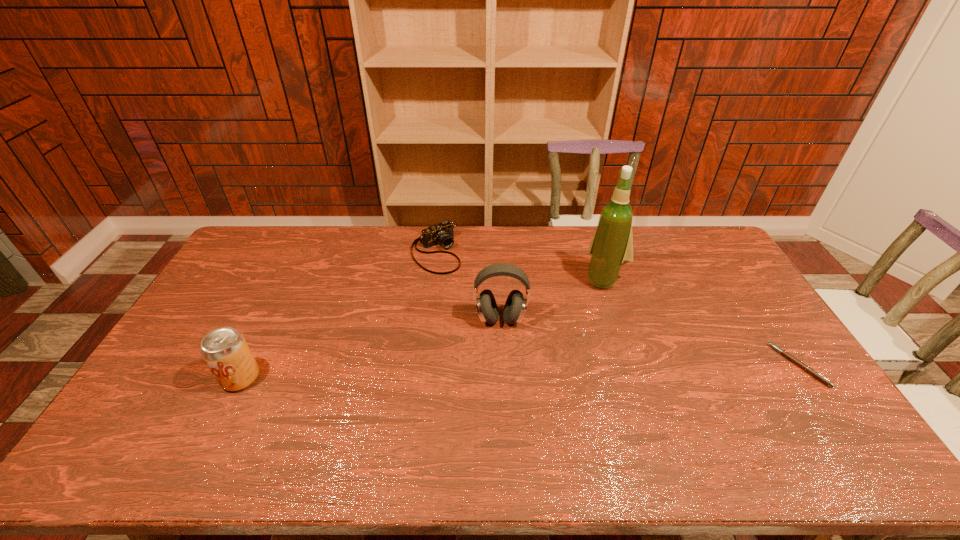
Identify the location of vacant space located on the ear cups of the headset. (494, 366).

Locate an element on the screen. This screenshot has height=540, width=960. free space located on the ear cups of the headset is located at coordinates (496, 354).

Find the location of `free space located on the ear cups of the headset`. free space located on the ear cups of the headset is located at coordinates (491, 411).

This screenshot has height=540, width=960. In order to click on object that is at the far edge in this screenshot , I will do `click(442, 233)`.

You are a GUI agent. You are given a task and a screenshot of the screen. Output one action in this format:
    pyautogui.click(x=<x>, y=<y>)
    Task: Click on the object present at the right edge
    This screenshot has height=540, width=960.
    Given the screenshot: What is the action you would take?
    [808, 369]

In the image, there is a desktop. At what (x,y) coordinates should I click in order to perform the action: click on vacant space at the far edge. Please return your answer as a coordinate pair (x, y). Looking at the image, I should click on (354, 244).

Find the location of a particular element. This screenshot has width=960, height=540. vacant region at the near edge of the desktop is located at coordinates (232, 415).

This screenshot has width=960, height=540. Identify the location of blank space at the left edge of the desktop. (215, 297).

Find the location of a particular element. The image size is (960, 540). vacant space at the right edge of the desktop is located at coordinates (724, 273).

Locate an element on the screen. The image size is (960, 540). vacant space at the far right corner is located at coordinates (710, 256).